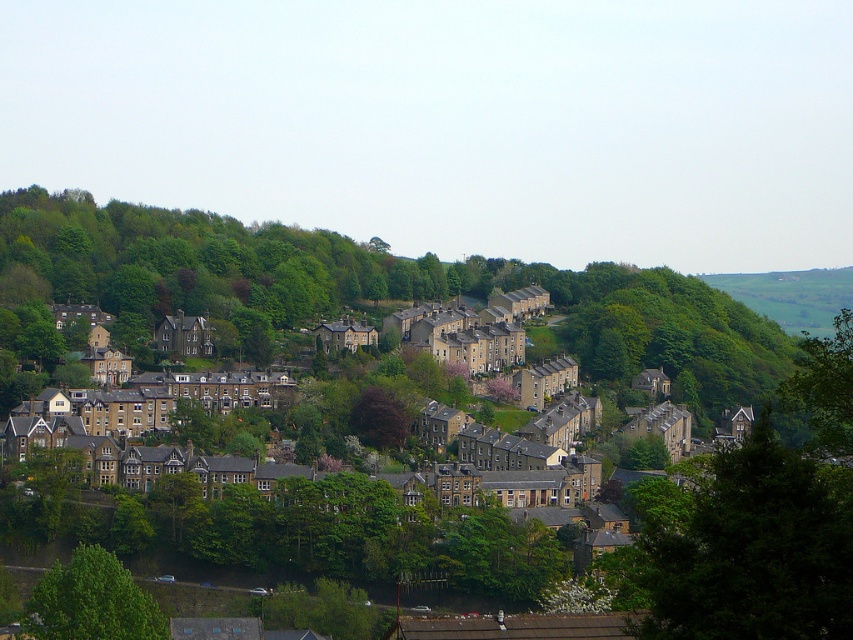
You are a landscape architect planning to plant a new tree in the residential area. You have two options from the image, the green leafy tree at center and the dark brown textured tree at center. Considering the space available between the houses, which tree would you recommend planting and why?

The green leafy tree at center is larger in size than the dark brown textured tree at center, so it would require more space. Since the houses are closely packed together, the dark brown textured tree at center is recommended as it takes up less space and fits better in the dense residential area.